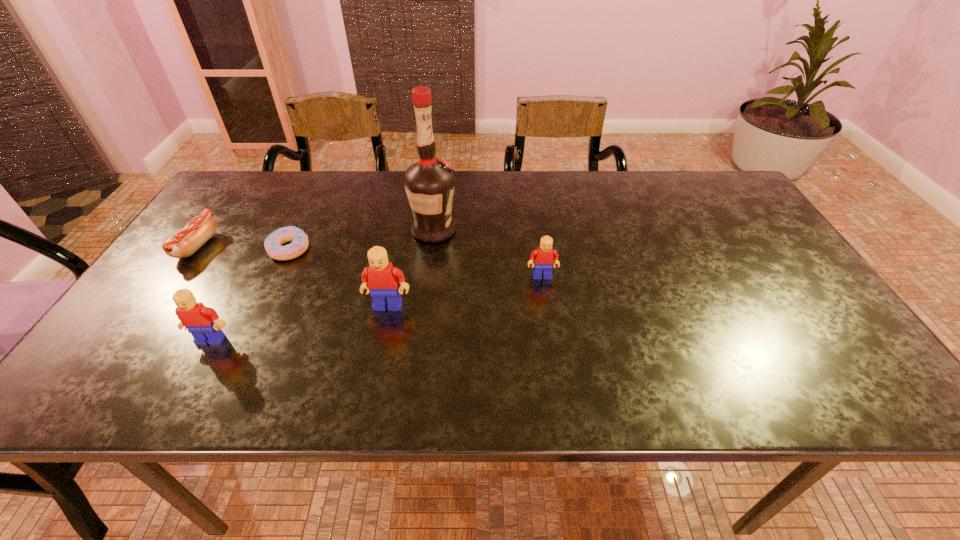
Image resolution: width=960 pixels, height=540 pixels. Find the location of `the second shortest Lego`. the second shortest Lego is located at coordinates (203, 323).

The width and height of the screenshot is (960, 540). I want to click on the nearest Lego, so click(203, 323).

Find the location of a particular element. The image size is (960, 540). the second farthest Lego is located at coordinates (381, 279).

Where is `the second nearest object`? the second nearest object is located at coordinates (381, 279).

In order to click on the rightmost Lego in this screenshot , I will do `click(545, 257)`.

The height and width of the screenshot is (540, 960). I want to click on the farthest Lego, so click(545, 257).

This screenshot has width=960, height=540. I want to click on liquor, so click(x=429, y=183).

Locate an element on the screen. the shortest object is located at coordinates (299, 239).

Locate an element on the screen. the leftmost object is located at coordinates (198, 231).

In order to click on sausage in this screenshot , I will do `click(198, 231)`.